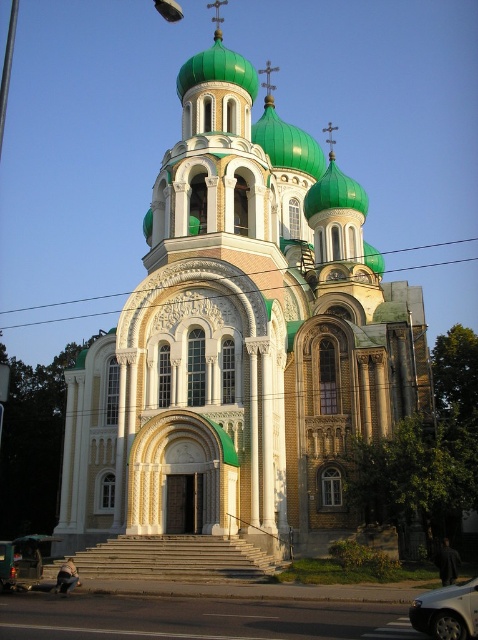
Between white stone church at center and white glossy car at lower right, which one appears on the left side from the viewer's perspective?

From the viewer's perspective, white stone church at center appears more on the left side.

This screenshot has height=640, width=478. Identify the location of white stone church at center. (240, 339).

Where is `white stone church at center`? The height and width of the screenshot is (640, 478). white stone church at center is located at coordinates (240, 339).